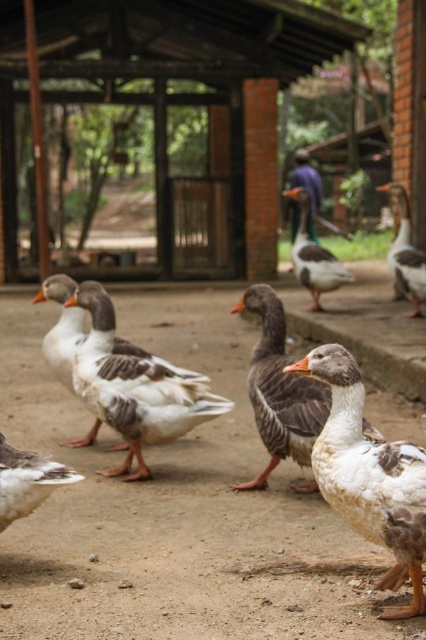
In the scene shown: Where is the gray matte goose at center located in the image?

The gray matte goose at center is located at point 0.609 on the x axis and 0.657 on the y axis.

You are standing in the farmyard and see the gray matte goose at center and the white matte duck at lower left. Which animal is positioned more to the right side of the scene?

The gray matte goose at center is positioned more to the right side of the scene compared to the white matte duck at lower left.